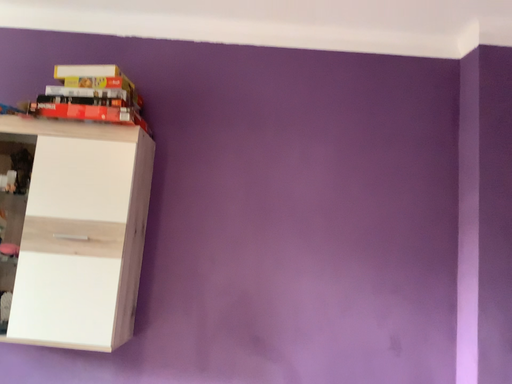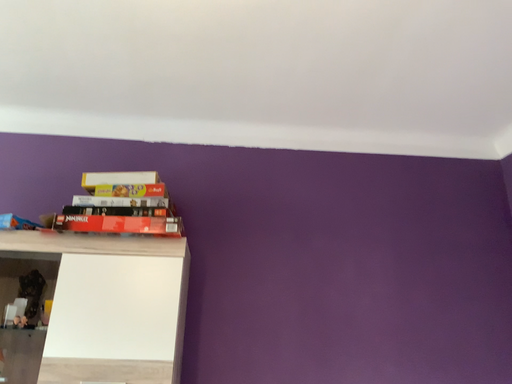
Question: Which way did the camera rotate in the video?

Choices:
 (A) rotated upward
 (B) rotated downward

Answer: (A)